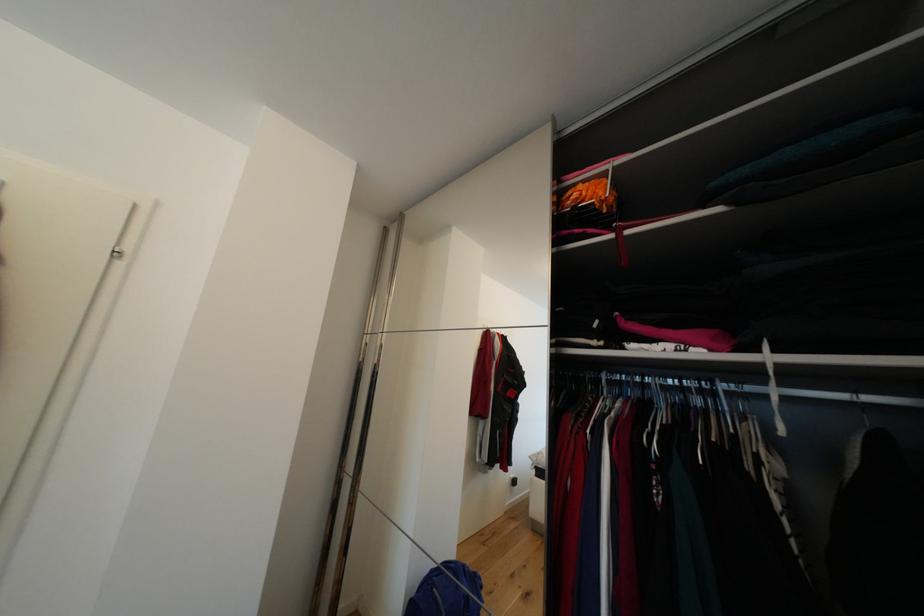
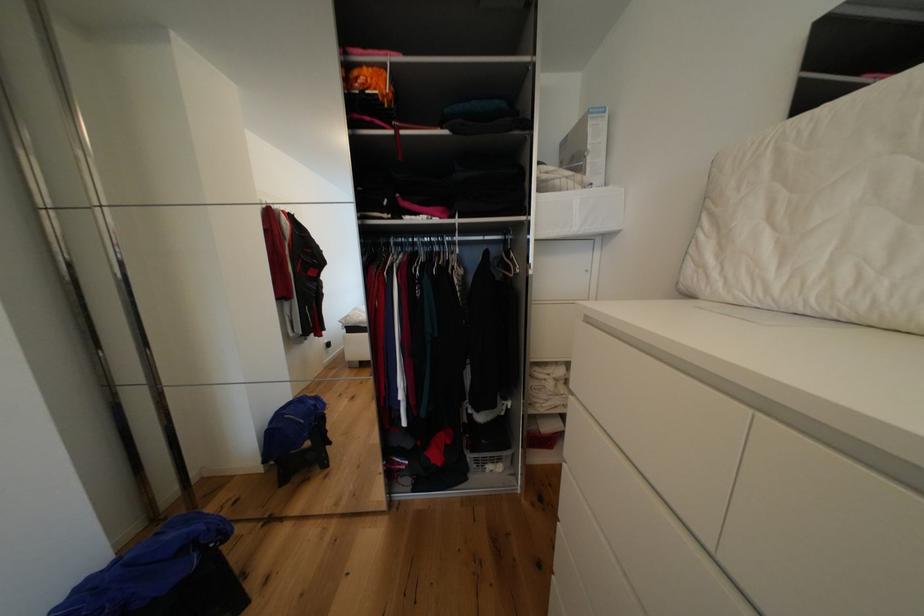
First-person continuous shooting, in which direction is the camera rotating?

The camera's rotation is toward right-down.